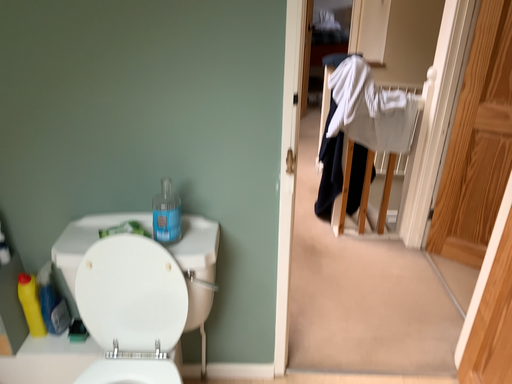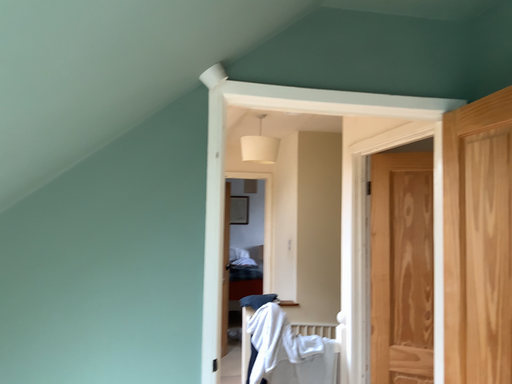
Question: How did the camera likely rotate when shooting the video?

Choices:
 (A) rotated left
 (B) rotated right

Answer: (B)